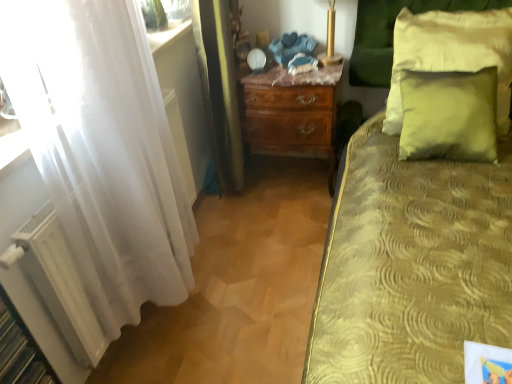
Where is `free location above mahogany wood nightstand at center (from a real-world perspective)`? Image resolution: width=512 pixels, height=384 pixels. free location above mahogany wood nightstand at center (from a real-world perspective) is located at coordinates (298, 72).